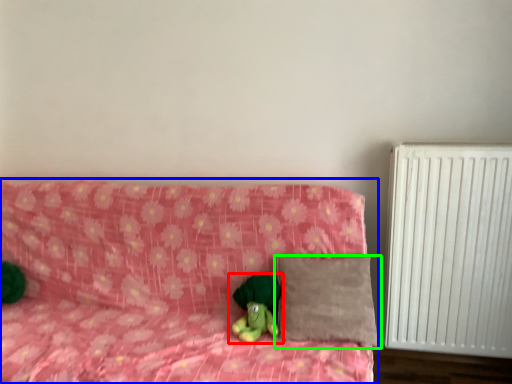
Question: Considering the real-world distances, which object is closest to toy (highlighted by a red box)? furniture (highlighted by a blue box) or pillow (highlighted by a green box).

Choices:
 (A) furniture
 (B) pillow

Answer: (B)